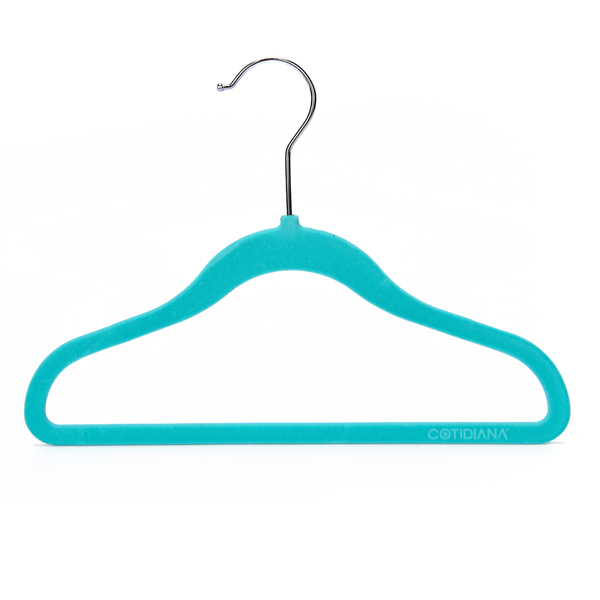
Find the location of `clear space to the upper left of hanger`. clear space to the upper left of hanger is located at coordinates (89, 111).